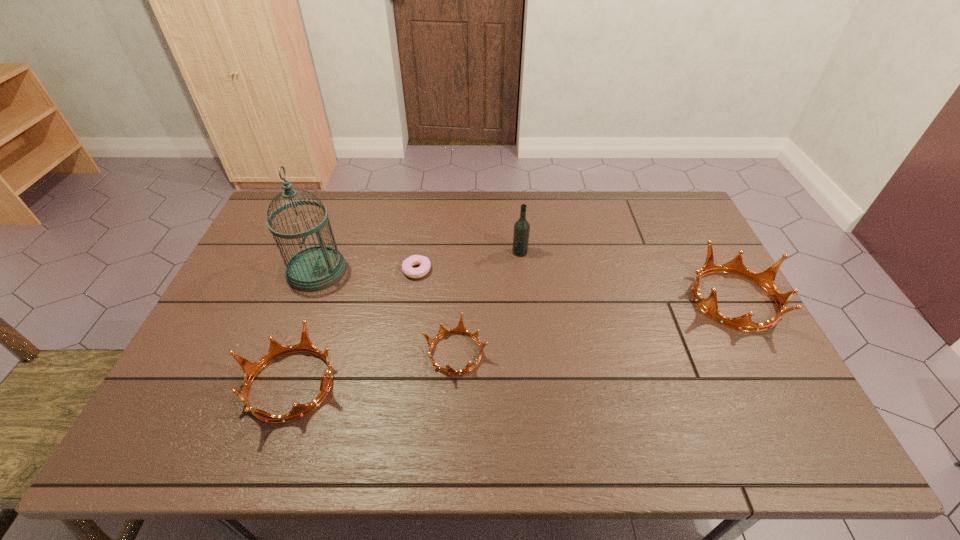
I want to click on vacant space located 0.220m on the back of the leftmost crown, so click(x=325, y=284).

Locate an element on the screen. Image resolution: width=960 pixels, height=540 pixels. vacant space located 0.400m on the back of the third object from right to left is located at coordinates pos(461,234).

You are a GUI agent. You are given a task and a screenshot of the screen. Output one action in this format:
    pyautogui.click(x=<x>, y=<y>)
    Task: Click on the vacant position located on the back of the rightmost crown
    This screenshot has width=960, height=540.
    Given the screenshot: What is the action you would take?
    pos(684,208)

The image size is (960, 540). I want to click on vacant space located on the front-facing side of the birdcage, so click(x=459, y=271).

I want to click on vacant space located on the right of the doughnut, so (x=450, y=271).

Locate an element on the screen. vacant region located 0.330m on the front of the second tallest object is located at coordinates (528, 340).

Where is `crown present at the left edge`? crown present at the left edge is located at coordinates (276, 350).

I want to click on birdcage that is at the left edge, so click(316, 267).

This screenshot has height=540, width=960. I want to click on object present at the right edge, so (766, 279).

Locate an element on the screen. This screenshot has width=960, height=540. object that is positioned at the near left corner is located at coordinates (276, 350).